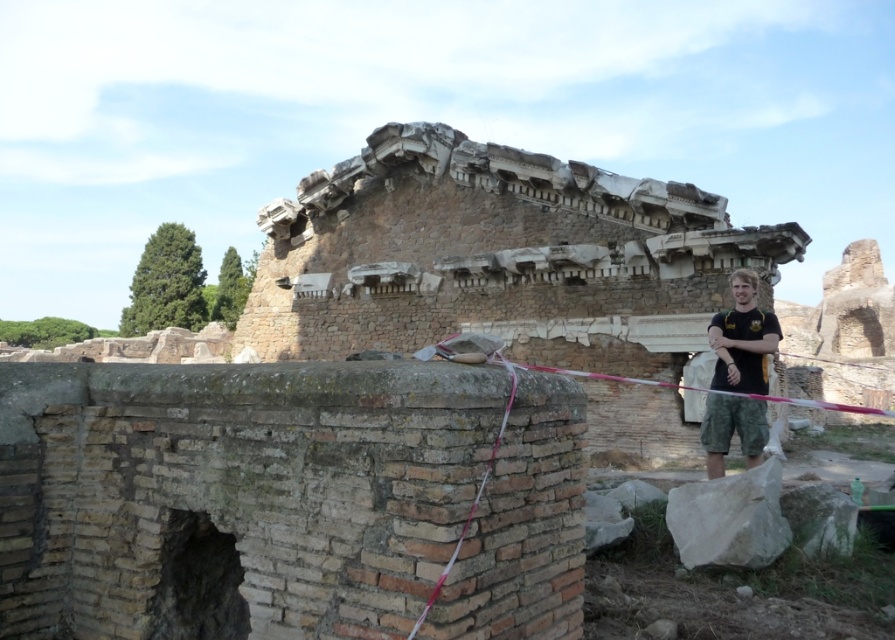
Question: Can you confirm if camouflage shorts at right is positioned below pink fabric rope at center?

Choices:
 (A) no
 (B) yes

Answer: (B)

Question: Is camouflage shorts at right positioned at the back of pink fabric rope at center?

Choices:
 (A) no
 (B) yes

Answer: (B)

Question: Which point is closer to the camera taking this photo?

Choices:
 (A) (739, 385)
 (B) (418, 625)

Answer: (B)

Question: Which object appears farthest from the camera in this image?

Choices:
 (A) pink fabric rope at center
 (B) camouflage shorts at right

Answer: (B)

Question: Can you confirm if camouflage shorts at right is wider than pink fabric rope at center?

Choices:
 (A) yes
 (B) no

Answer: (A)